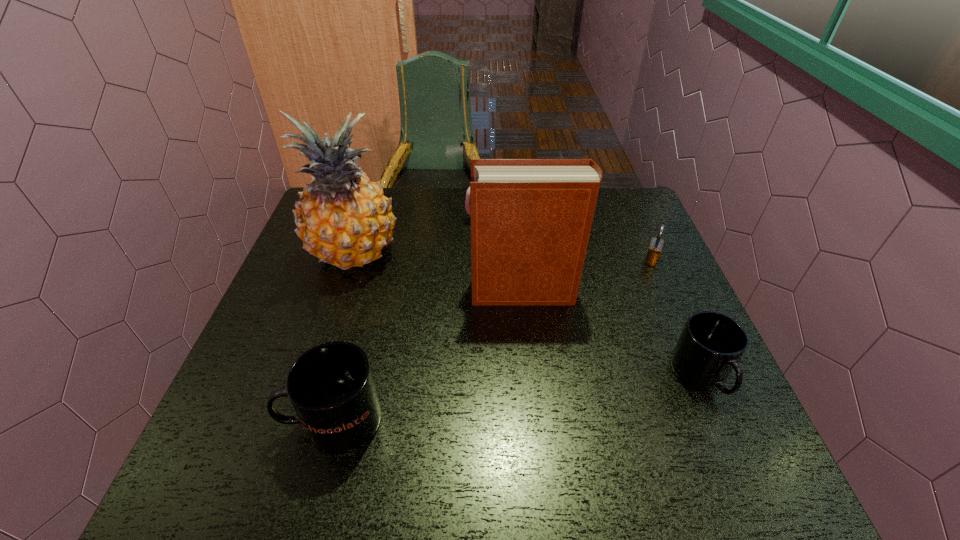
Find the location of a particular element. the tallest mug is located at coordinates [331, 387].

You are a GUI agent. You are given a task and a screenshot of the screen. Output one action in this format:
    pyautogui.click(x=<x>, y=<y>)
    Task: Click on the third tallest object
    This screenshot has width=960, height=540.
    Given the screenshot: What is the action you would take?
    pyautogui.click(x=331, y=387)

Identify the location of the rightmost mug. This screenshot has height=540, width=960. (711, 345).

You are a GUI agent. You are given a task and a screenshot of the screen. Output one action in this format:
    pyautogui.click(x=<x>, y=<y>)
    Task: Click on the second mug from right to left
    
    Given the screenshot: What is the action you would take?
    pyautogui.click(x=467, y=206)

This screenshot has width=960, height=540. What are the coordinates of `pineapple` in the screenshot? It's located at (343, 218).

At what (x,y) coordinates should I click in order to perform the action: click on padlock. Please return your answer as a coordinate pair (x, y). Image resolution: width=960 pixels, height=540 pixels. Looking at the image, I should click on (656, 244).

The width and height of the screenshot is (960, 540). What are the coordinates of `hardback book` in the screenshot? It's located at (531, 219).

The image size is (960, 540). I want to click on blank space located 0.130m with the handle on the side of the tallest mug, so click(x=221, y=420).

In order to click on vacant position located with the handle on the side of the tallest mug in this screenshot , I will do `click(221, 420)`.

You are a GUI agent. You are given a task and a screenshot of the screen. Output one action in this format:
    pyautogui.click(x=<x>, y=<y>)
    Task: Click on the free point located 0.380m on the side of the farthest mug with the handle
    The height and width of the screenshot is (540, 960).
    Given the screenshot: What is the action you would take?
    pyautogui.click(x=342, y=220)